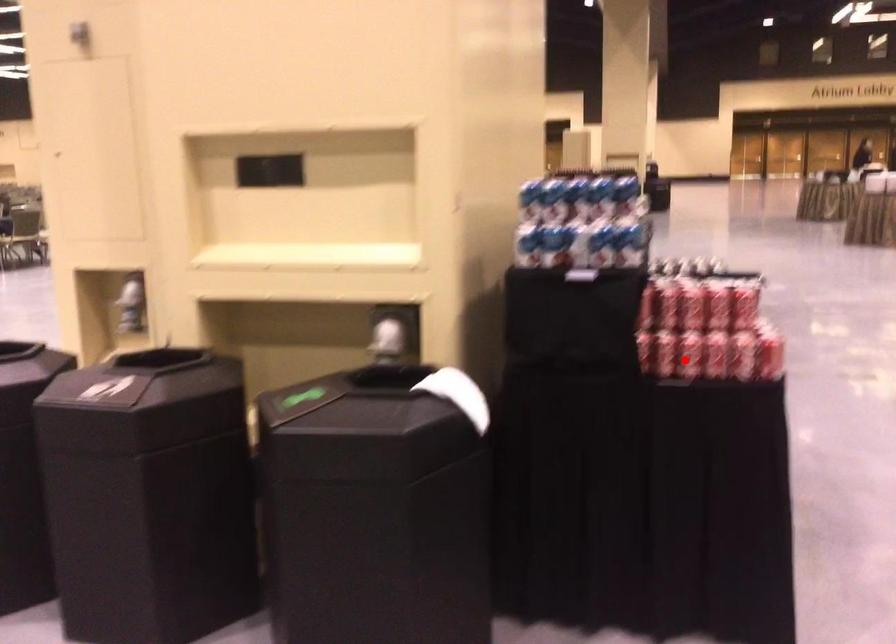
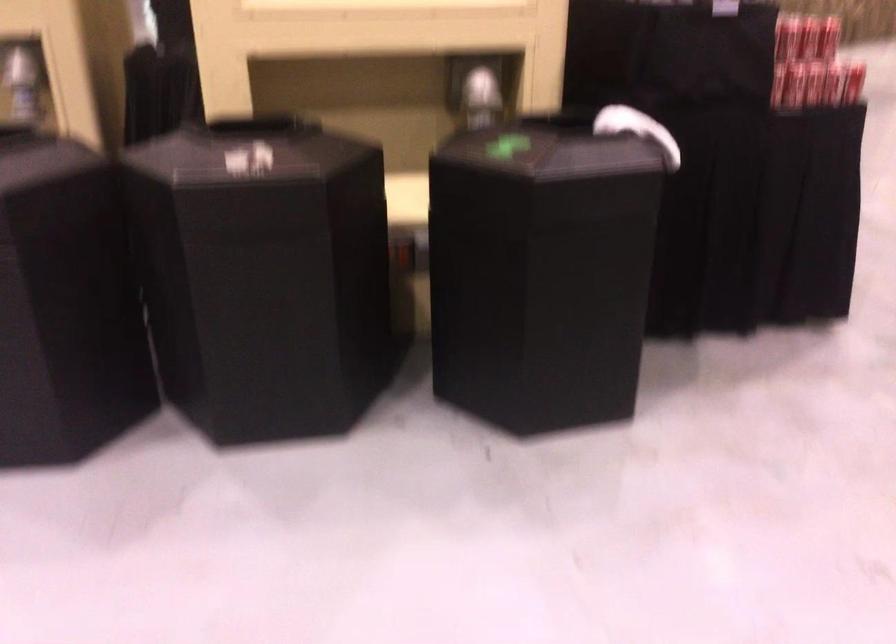
Locate, in the second image, the point that corresponds to the highlighted location in the first image.

(810, 84)